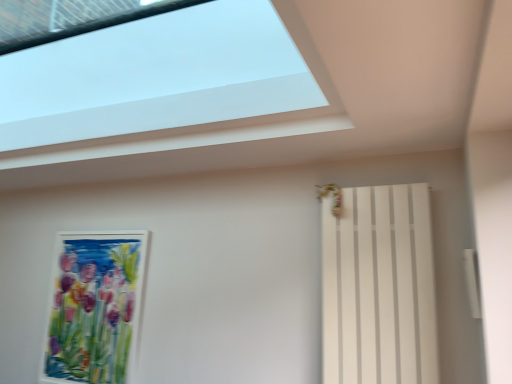
Question: Should I look upward or downward to see white matte radiator at right?

Choices:
 (A) up
 (B) down

Answer: (B)

Question: Can you confirm if white matte radiator at right is shorter than transparent glass window at upper center?

Choices:
 (A) yes
 (B) no

Answer: (B)

Question: Considering the relative sizes of white matte radiator at right and transparent glass window at upper center in the image provided, is white matte radiator at right thinner than transparent glass window at upper center?

Choices:
 (A) yes
 (B) no

Answer: (A)

Question: From the image's perspective, is white matte radiator at right located above transparent glass window at upper center?

Choices:
 (A) yes
 (B) no

Answer: (B)

Question: Considering the relative positions of white matte radiator at right and transparent glass window at upper center in the image provided, is white matte radiator at right to the right of transparent glass window at upper center from the viewer's perspective?

Choices:
 (A) no
 (B) yes

Answer: (B)

Question: From a real-world perspective, is white matte radiator at right beneath transparent glass window at upper center?

Choices:
 (A) yes
 (B) no

Answer: (A)

Question: Is white matte radiator at right further to the viewer compared to transparent glass window at upper center?

Choices:
 (A) yes
 (B) no

Answer: (A)

Question: From a real-world perspective, is white matte radiator at right under watercolor paper painting at left?

Choices:
 (A) no
 (B) yes

Answer: (A)

Question: Is the depth of white matte radiator at right greater than that of watercolor paper painting at left?

Choices:
 (A) no
 (B) yes

Answer: (A)

Question: Is white matte radiator at right wider than watercolor paper painting at left?

Choices:
 (A) yes
 (B) no

Answer: (A)

Question: From a real-world perspective, is white matte radiator at right on top of watercolor paper painting at left?

Choices:
 (A) yes
 (B) no

Answer: (A)

Question: Is white matte radiator at right shorter than watercolor paper painting at left?

Choices:
 (A) yes
 (B) no

Answer: (A)

Question: Is white matte radiator at right located outside watercolor paper painting at left?

Choices:
 (A) yes
 (B) no

Answer: (A)

Question: From a real-world perspective, is watercolor paper painting at left beneath white matte radiator at right?

Choices:
 (A) yes
 (B) no

Answer: (A)